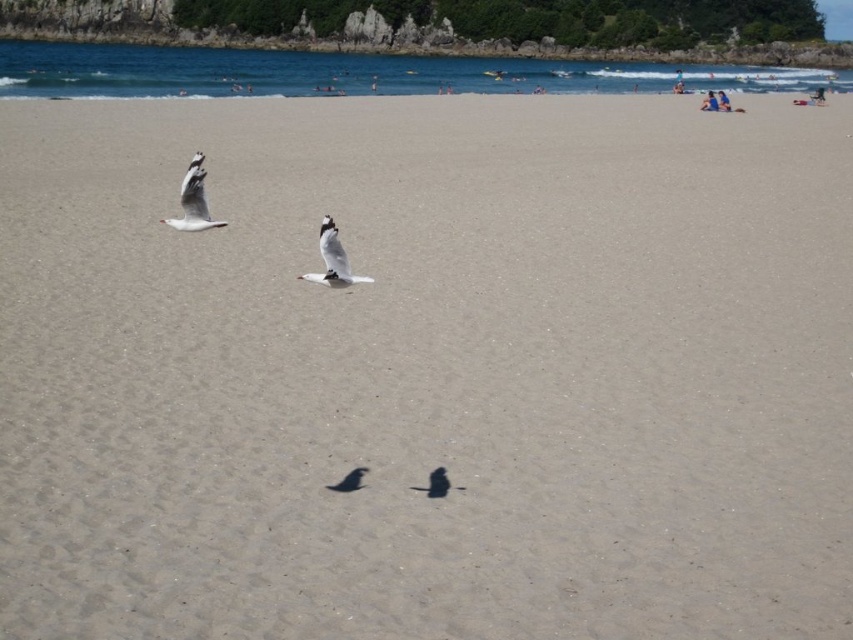
Between white feathered bird at center and white matte bird at center, which one is positioned lower?

white feathered bird at center is below.

Is point (444, 467) in front of point (363, 467)?

No.

Locate an element on the screen. Image resolution: width=853 pixels, height=640 pixels. white feathered bird at center is located at coordinates (434, 483).

Is white matte seagull at upper left further to camera compared to white matte bird at center?

No, white matte seagull at upper left is in front of white matte bird at center.

Is white matte seagull at upper left thinner than white matte bird at center?

Incorrect, white matte seagull at upper left's width is not less than white matte bird at center's.

Does point (204, 157) lie behind point (347, 486)?

That is True.

The width and height of the screenshot is (853, 640). What are the coordinates of `white matte seagull at upper left` in the screenshot? It's located at (193, 198).

Is white matte seagull at center closer to the viewer compared to white matte bird at center?

Yes, it is in front of white matte bird at center.

Does white matte seagull at center have a lesser height compared to white matte bird at center?

Incorrect, white matte seagull at center's height does not fall short of white matte bird at center's.

Who is more forward, [337,236] or [357,474]?

Point [337,236] is in front.

Identify the location of white matte seagull at center. This screenshot has width=853, height=640. (332, 259).